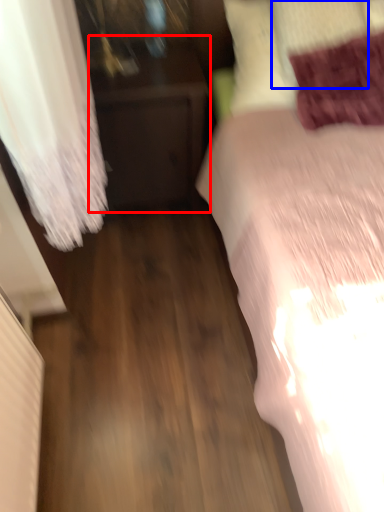
Question: Which object is closer to the camera taking this photo, furniture (highlighted by a red box) or pillow (highlighted by a blue box)?

Choices:
 (A) furniture
 (B) pillow

Answer: (B)